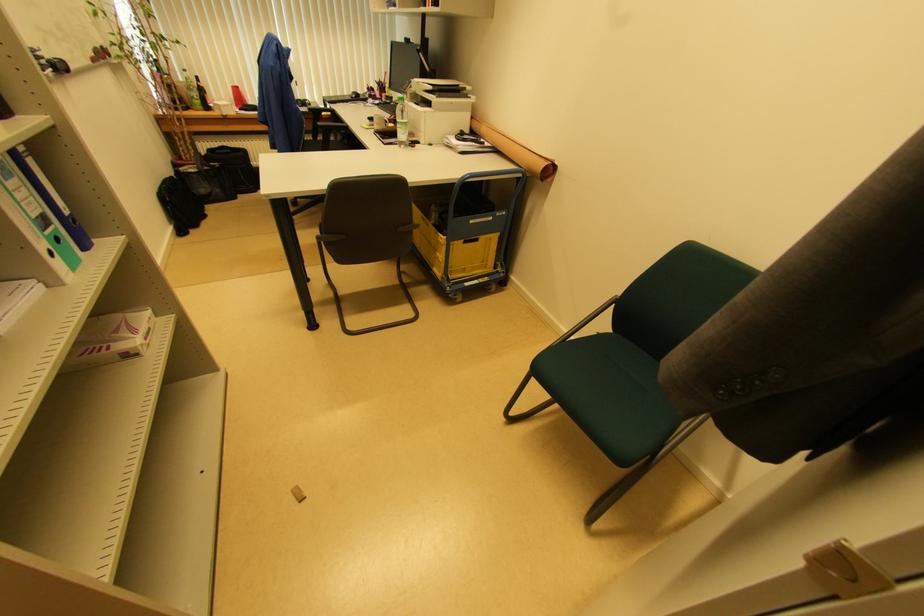
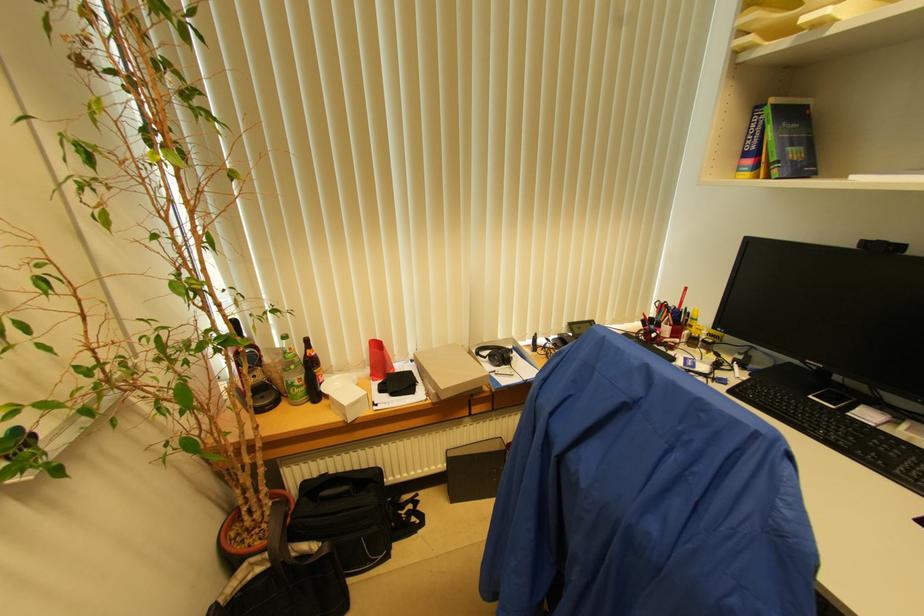
In a continuous first-person perspective shot, in which direction is the camera moving?

The cameraman moved toward left, forward.